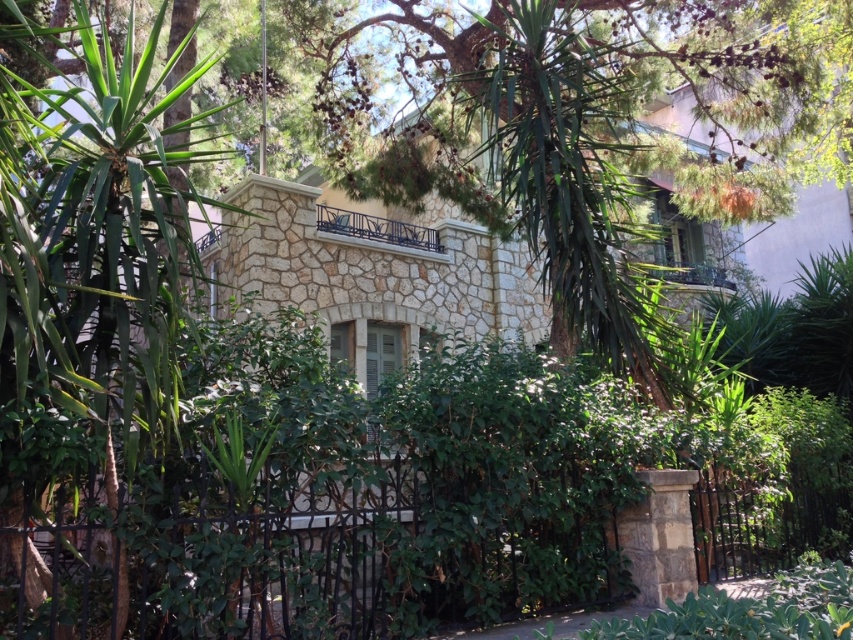
Question: Is green leafy tree at center thinner than iron/black at center?

Choices:
 (A) yes
 (B) no

Answer: (A)

Question: Can you confirm if green leafy tree at center is smaller than iron/black at center?

Choices:
 (A) no
 (B) yes

Answer: (B)

Question: Which point appears closest to the camera in this image?

Choices:
 (A) (811, 99)
 (B) (310, 636)

Answer: (B)

Question: Which of the following is the closest to the observer?

Choices:
 (A) iron/black at center
 (B) green leafy tree at center

Answer: (A)

Question: Does green leafy tree at center appear on the left side of iron/black at center?

Choices:
 (A) no
 (B) yes

Answer: (A)